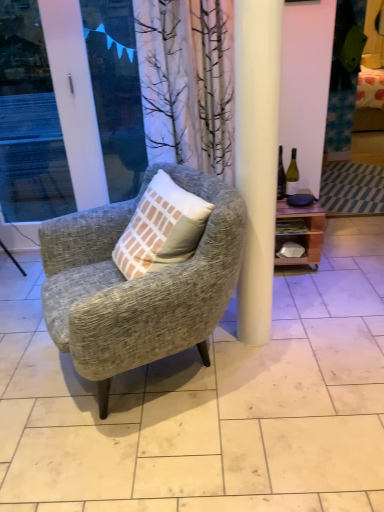
Question: Is white glossy screen door at left touching wooden shelf at right?

Choices:
 (A) yes
 (B) no

Answer: (B)

Question: Can you confirm if white glossy screen door at left is shorter than wooden shelf at right?

Choices:
 (A) yes
 (B) no

Answer: (B)

Question: Is white glossy screen door at left turned away from wooden shelf at right?

Choices:
 (A) yes
 (B) no

Answer: (B)

Question: Is white glossy screen door at left to the left of wooden shelf at right from the viewer's perspective?

Choices:
 (A) no
 (B) yes

Answer: (B)

Question: Is white glossy screen door at left outside wooden shelf at right?

Choices:
 (A) no
 (B) yes

Answer: (B)

Question: Considering the relative positions of white glossy screen door at left and wooden shelf at right in the image provided, is white glossy screen door at left to the right of wooden shelf at right from the viewer's perspective?

Choices:
 (A) no
 (B) yes

Answer: (A)

Question: Could green glass bottle at right be considered to be inside textured gray armchair at center?

Choices:
 (A) no
 (B) yes

Answer: (A)

Question: Is textured gray armchair at center further to the viewer compared to green glass bottle at right?

Choices:
 (A) no
 (B) yes

Answer: (A)

Question: Is textured gray armchair at center in front of green glass bottle at right?

Choices:
 (A) no
 (B) yes

Answer: (B)

Question: Is textured gray armchair at center positioned with its back to green glass bottle at right?

Choices:
 (A) no
 (B) yes

Answer: (B)

Question: From the image's perspective, is textured gray armchair at center under green glass bottle at right?

Choices:
 (A) yes
 (B) no

Answer: (A)

Question: Is textured gray armchair at center bigger than green glass bottle at right?

Choices:
 (A) no
 (B) yes

Answer: (B)

Question: Can you confirm if textured gray armchair at center is shorter than white glossy screen door at left?

Choices:
 (A) no
 (B) yes

Answer: (B)